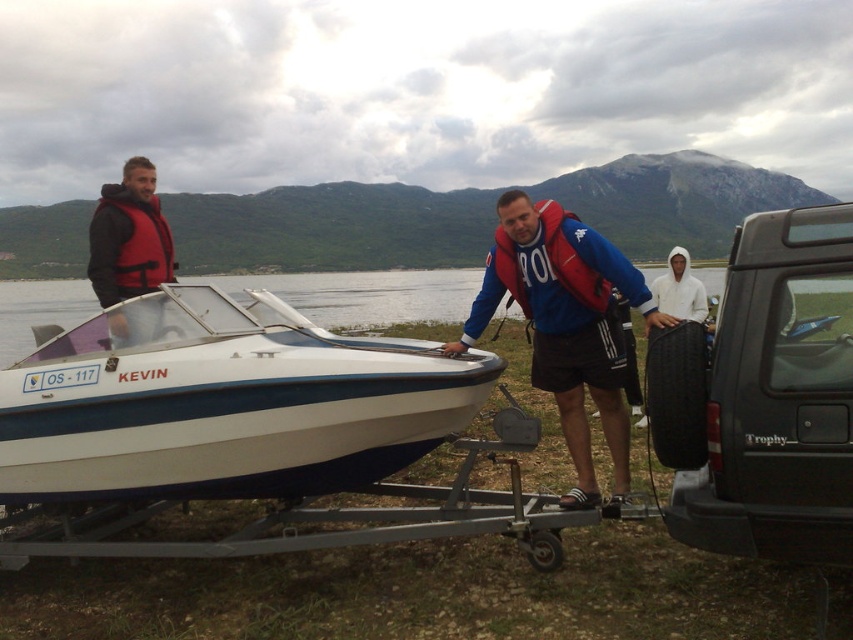
The width and height of the screenshot is (853, 640). Describe the element at coordinates (566, 324) in the screenshot. I see `red fabric life vest at center` at that location.

Which is in front, point (619, 349) or point (698, 300)?

Point (619, 349) is more forward.

Which is in front, point (531, 292) or point (654, 291)?

Point (531, 292) is more forward.

Locate an element on the screen. The image size is (853, 640). red fabric life vest at center is located at coordinates (566, 324).

Can you confirm if black rubber tire at lower right is wider than white hoodie at center?

Yes, black rubber tire at lower right is wider than white hoodie at center.

Is black rubber tire at lower right closer to the viewer compared to white hoodie at center?

Yes, black rubber tire at lower right is in front of white hoodie at center.

Identify the location of black rubber tire at lower right. Image resolution: width=853 pixels, height=640 pixels. (764, 396).

Looking at this image, can you confirm if white glossy boat at center is taller than black rubber tire at lower right?

No.

Which is in front, point (257, 324) or point (798, 497)?

Point (798, 497)

The width and height of the screenshot is (853, 640). Identify the location of white glossy boat at center. [x=222, y=403].